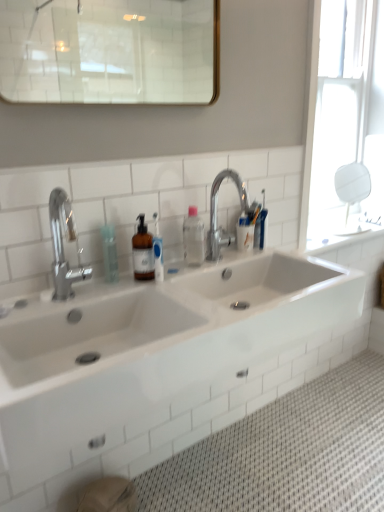
You are a GUI agent. You are given a task and a screenshot of the screen. Output one action in this format:
    pyautogui.click(x=<x>, y=<y>)
    Task: Click on the free region on the left part of transparent plastic bottle at center
    Image resolution: width=384 pixels, height=512 pixels.
    Given the screenshot: What is the action you would take?
    pyautogui.click(x=76, y=288)